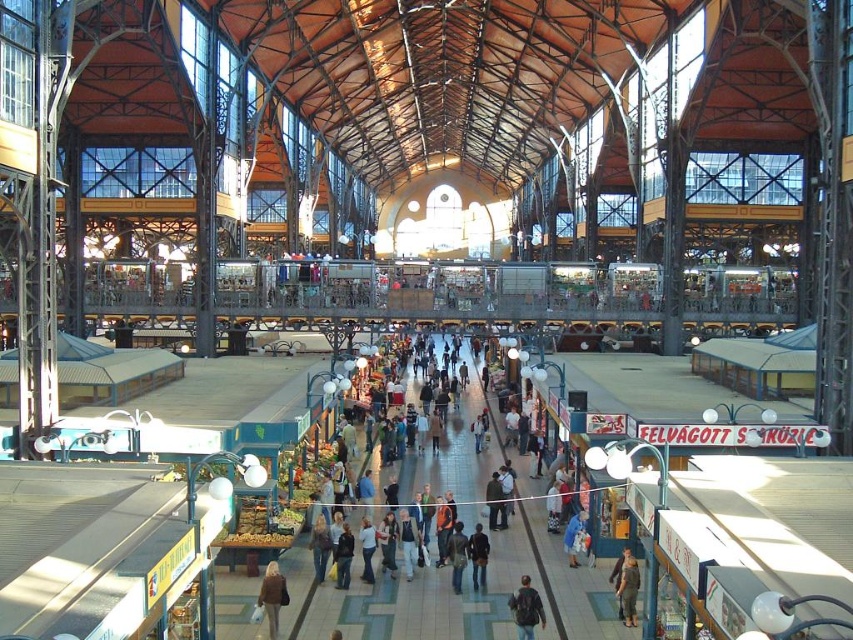
You are standing in the market hall and want to pick up the brown fabric pants at center and the dark brown leather jacket at center. Which item is easier to reach without moving your current position?

The brown fabric pants at center is closer to the viewer than the dark brown leather jacket at center, so it is easier to reach without moving.

You are standing at the entrance of the market hall and want to reach the point marked at coordinates point (631, 620). If your walking speed is 3 feet per second, how many seconds will it take you to reach that point?

The distance of point (631, 620) from camera is 151.43 feet. At a walking speed of 3 feet per second, it will take approximately 151.43 divided by 3 equals 50.48 seconds, so about 50.5 seconds.